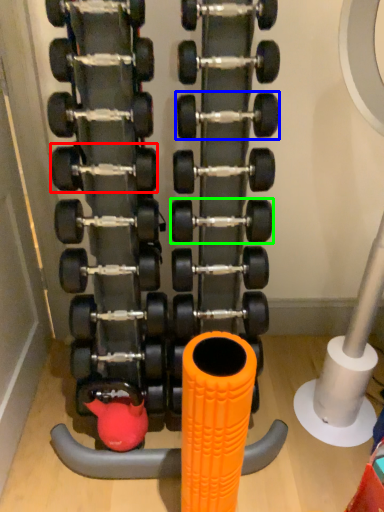
Question: Estimate the real-world distances between objects in this image. Which object is farther from dumbbell (highlighted by a red box), dumbbell (highlighted by a blue box) or dumbbell (highlighted by a green box)?

Choices:
 (A) dumbbell
 (B) dumbbell

Answer: (B)